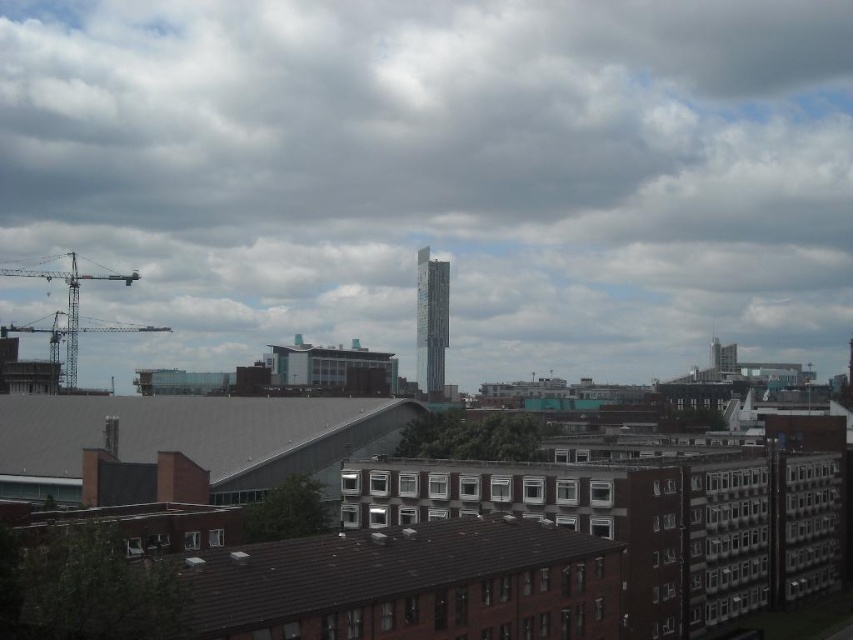
Question: Which object appears closest to the camera in this image?

Choices:
 (A) white fluffy cloud at upper center
 (B) gray concrete construction site at center

Answer: (B)

Question: Is gray concrete construction site at center thinner than metallic gray crane at left?

Choices:
 (A) yes
 (B) no

Answer: (A)

Question: Does gray concrete construction site at center come in front of silver glass tower at center?

Choices:
 (A) no
 (B) yes

Answer: (B)

Question: Which object is farther from the camera taking this photo?

Choices:
 (A) metallic gray crane at left
 (B) gray concrete construction site at center
 (C) white fluffy cloud at upper center
 (D) silver glass tower at center

Answer: (D)

Question: Among these objects, which one is farthest from the camera?

Choices:
 (A) white fluffy cloud at upper center
 (B) gray concrete construction site at center
 (C) metallic gray crane at left
 (D) silver glass tower at center

Answer: (D)

Question: Can you confirm if silver glass tower at center is wider than metallic gray crane at left?

Choices:
 (A) yes
 (B) no

Answer: (B)